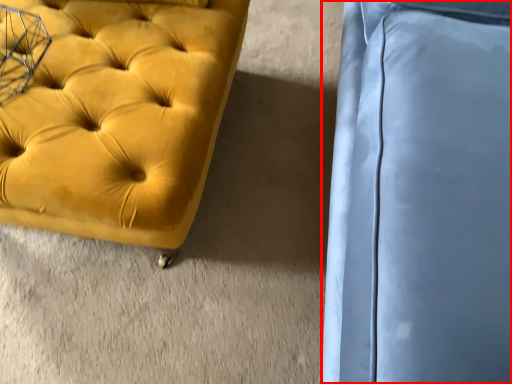
Question: From the image's perspective, where is swivel chair (annotated by the red box) located in relation to furniture in the image?

Choices:
 (A) above
 (B) below

Answer: (A)